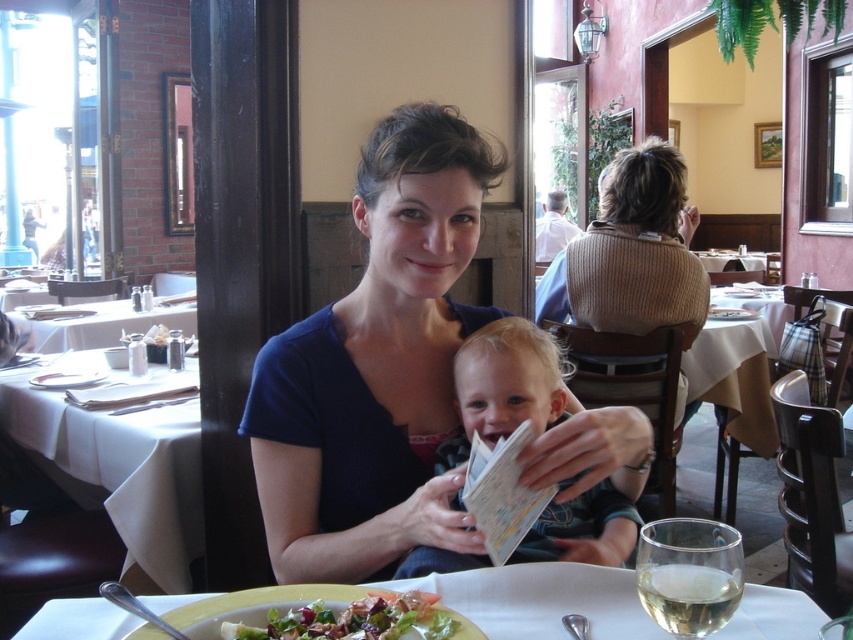
Question: Does white cloth at lower left have a lesser width compared to fresh green salad at lower center?

Choices:
 (A) no
 (B) yes

Answer: (A)

Question: Which is nearer to the white cloth at lower left?

Choices:
 (A) smooth green bib at center
 (B) knitted beige sweater at upper right
 (C) matte blue shirt at center

Answer: (C)

Question: Is matte blue shirt at center below white ceramic plate at lower center?

Choices:
 (A) yes
 (B) no

Answer: (B)

Question: Can you confirm if white cloth at lower left is wider than knitted beige sweater at upper right?

Choices:
 (A) yes
 (B) no

Answer: (A)

Question: Which point is closer to the camera?

Choices:
 (A) knitted beige sweater at upper right
 (B) white cloth at lower left

Answer: (B)

Question: Among these objects, which one is farthest from the camera?

Choices:
 (A) white glossy table at left
 (B) white ceramic plate at lower center
 (C) fresh green salad at lower center
 (D) knitted beige sweater at upper right

Answer: (A)